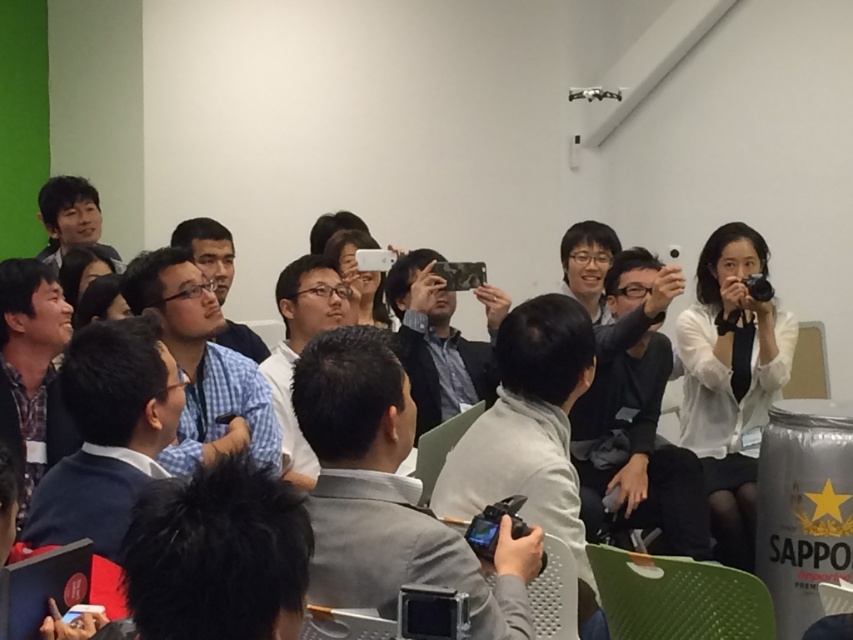
You are standing in the room and see a point at coordinates (387, 493). What object is this point located on?

The point at coordinates (387, 493) is located on the gray fabric shirt at center.